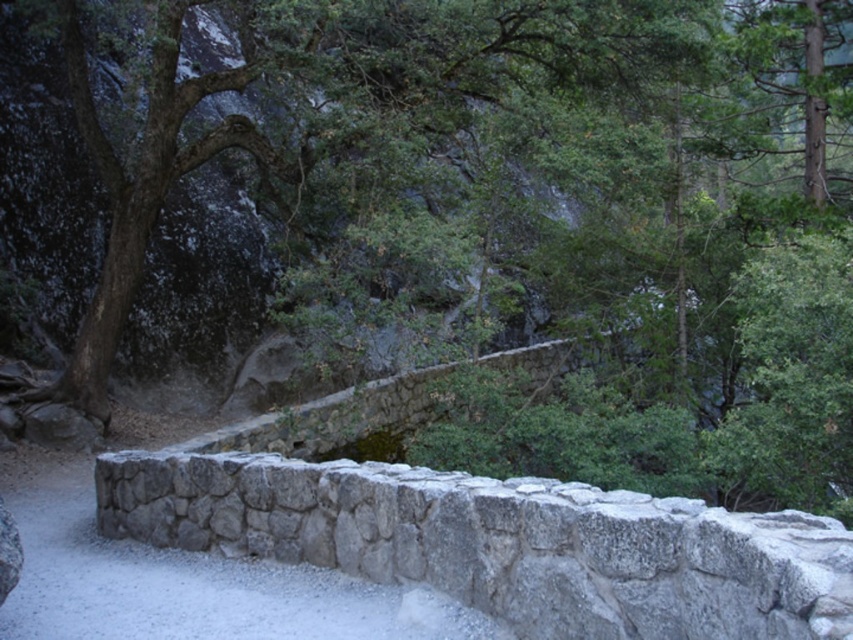
You are standing on the gravel path in the forest scene. You see two points marked in the image. Which point is nearer to you, point [706,573] or point [55,528]?

Point [706,573] is closer to the viewer than point 0.066, so you are nearer to point [706,573].

You are standing on the gravel path and see the gray stone wall at lower center and the gray stone wall at center. Which gray stone wall is positioned to the right side of the other?

The gray stone wall at lower center is to the right of the gray stone wall at center.

You are a hiker who wants to cross the gray stone wall at lower center and the gray stone wall at center. Which wall would be easier to climb over?

The gray stone wall at center has a smaller height compared to the gray stone wall at lower center, so it would be easier to climb over the gray stone wall at center.